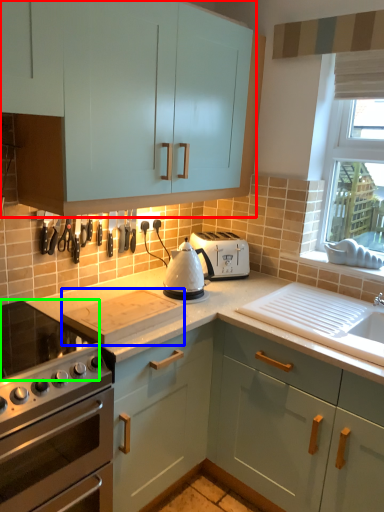
Question: Considering the real-world distances, which object is closest to cabinetry (highlighted by a red box)? appliance (highlighted by a blue box) or gas stove (highlighted by a green box).

Choices:
 (A) appliance
 (B) gas stove

Answer: (A)